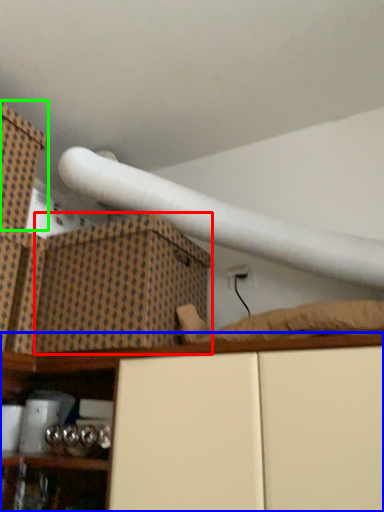
Question: Considering the real-world distances, which object is farthest from cardboard box (highlighted by a red box)? shelf (highlighted by a blue box) or box (highlighted by a green box)?

Choices:
 (A) shelf
 (B) box

Answer: (B)